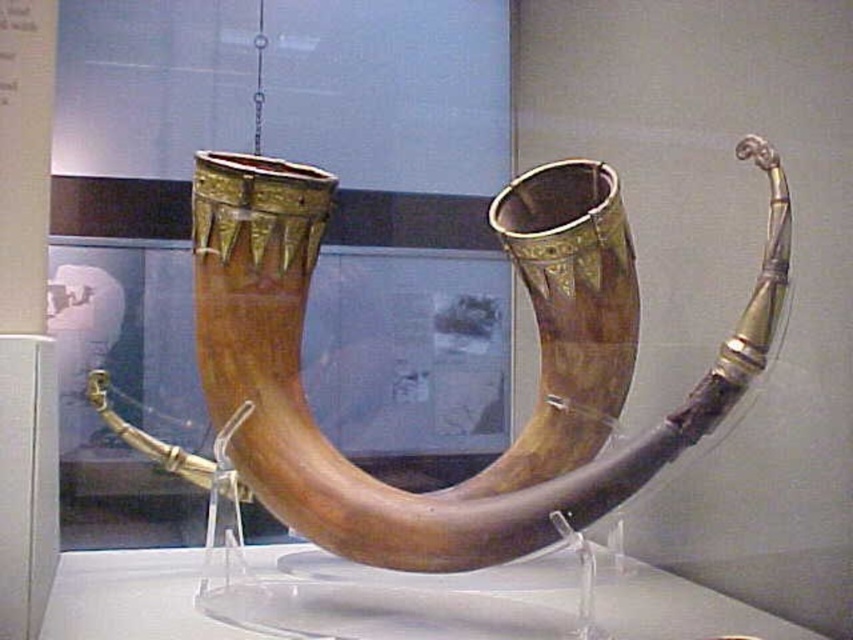
Question: Does polished wood horn at center have a larger size compared to transparent acrylic table at center?

Choices:
 (A) no
 (B) yes

Answer: (B)

Question: Is polished wood horn at center thinner than transparent acrylic table at center?

Choices:
 (A) yes
 (B) no

Answer: (A)

Question: Which point is closer to the camera taking this photo?

Choices:
 (A) click(59, 621)
 (B) click(265, 388)

Answer: (A)

Question: Does polished wood horn at center have a greater width compared to transparent acrylic table at center?

Choices:
 (A) yes
 (B) no

Answer: (B)

Question: Which of the following is the farthest from the observer?

Choices:
 (A) transparent acrylic table at center
 (B) polished wood horn at center

Answer: (A)